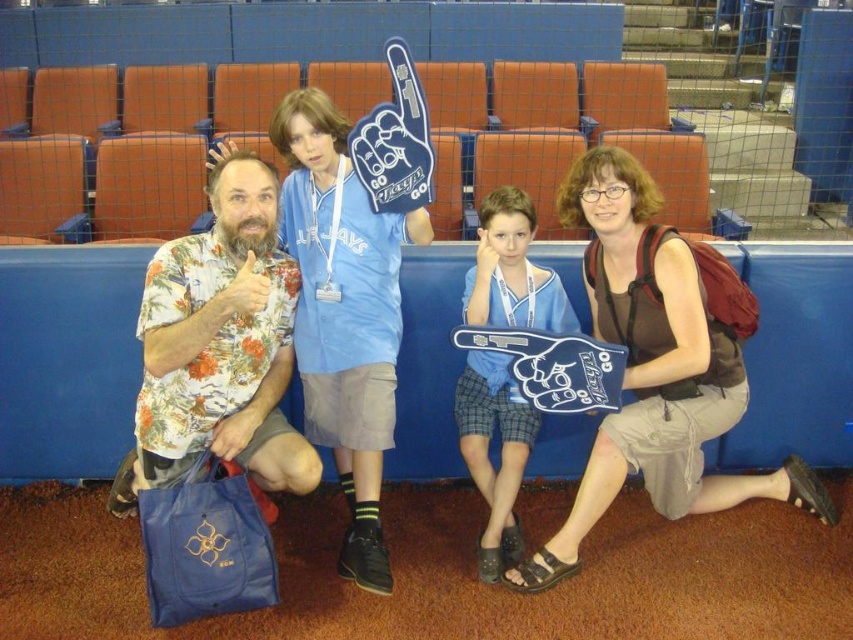
You are a photographer trying to capture a photo of the blue foam finger at center and the floral print shirt at left. The camera you are using has a minimum focusing distance of 36 inches. Will you be able to take a clear photo of both objects without moving the camera?

The distance between the blue foam finger at center and the floral print shirt at left is 35.14 inches, which is less than the camera minimum focusing distance of 36 inches. Therefore, the camera will not be able to focus clearly on both objects simultaneously without moving the camera.

You are standing in the stadium and see two points marked in the image. Which point is closer to you, point [260,241] or point [466,305]?

Point [260,241] is closer to you than point [466,305].

Consider the image. You are a photographer at the stadium and need to position yourself so that both the brown fabric backpack at lower right and the floral print shirt at left are visible in your shot. Based on their positions, which object should you ensure is closer to the bottom of the frame?

The brown fabric backpack at lower right is below floral print shirt at left, so you should ensure the brown fabric backpack at lower right is closer to the bottom of the frame.